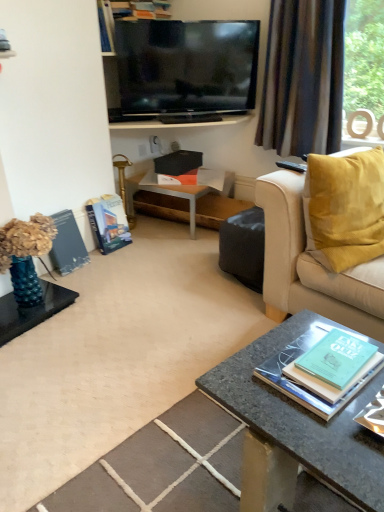
The height and width of the screenshot is (512, 384). I want to click on unoccupied area in front of green matte book at lower right, which appears as the 1th book when ordered from the bottom, so click(326, 437).